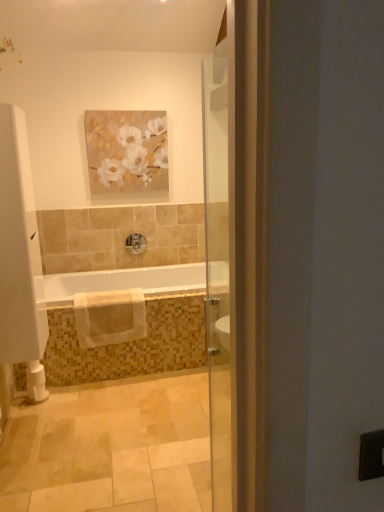
What is the approximate width of white towel at center?

white towel at center is 32.50 inches in width.

Describe the element at coordinates (136, 243) in the screenshot. I see `satin nickel faucet at center` at that location.

Identify the location of beige cotton towel at lower center. (109, 317).

What is the approximate height of white glossy bathtub at center?

white glossy bathtub at center is 0.75 inches in height.

This screenshot has width=384, height=512. What are the coordinates of `white towel at center` in the screenshot? It's located at (136, 340).

Does point (56, 288) come in front of point (105, 118)?

That is True.

Based on the photo, would you say matte floral painting at upper center is part of white glossy bathtub at center's contents?

No, white glossy bathtub at center does not contain matte floral painting at upper center.

Based on the photo, how much distance is there between white glossy bathtub at center and matte floral painting at upper center?

They are 3.37 feet apart.

Is white glossy bathtub at center facing away from matte floral painting at upper center?

No, white glossy bathtub at center is not facing away from matte floral painting at upper center.

Between point (165, 130) and point (64, 308), which one is positioned in front?

Point (64, 308)

Are matte floral painting at upper center and white towel at center making contact?

No, matte floral painting at upper center is not touching white towel at center.

From a real-world perspective, which is physically above, matte floral painting at upper center or white towel at center?

matte floral painting at upper center, from a real-world perspective.

In terms of height, does matte floral painting at upper center look taller or shorter compared to white towel at center?

matte floral painting at upper center is taller than white towel at center.

Measure the distance from beige cotton towel at lower center to satin nickel faucet at center.

beige cotton towel at lower center is 38.89 inches away from satin nickel faucet at center.

Which is more to the right, beige cotton towel at lower center or satin nickel faucet at center?

Positioned to the right is satin nickel faucet at center.

Is beige cotton towel at lower center positioned before satin nickel faucet at center?

Yes, beige cotton towel at lower center is closer to the viewer.

Consider the image. From the image's perspective, is beige cotton towel at lower center beneath satin nickel faucet at center?

Indeed, from the image's perspective, beige cotton towel at lower center is shown beneath satin nickel faucet at center.

Which of these two, white towel at center or white glossy bathtub at center, is smaller?

white glossy bathtub at center is smaller.

Based on the photo, how many degrees apart are the facing directions of white towel at center and white glossy bathtub at center?

white towel at center and white glossy bathtub at center are facing 0.168 degrees away from each other.

Is white towel at center not inside white glossy bathtub at center?

white towel at center is positioned outside white glossy bathtub at center.

From the image's perspective, is white towel at center above or below white glossy bathtub at center?

Based on their image positions, white towel at center is located beneath white glossy bathtub at center.

Considering the relative positions of white glossy bathtub at center and satin nickel faucet at center in the image provided, is white glossy bathtub at center to the left or to the right of satin nickel faucet at center?

white glossy bathtub at center is positioned on satin nickel faucet at center's right side.

Is white glossy bathtub at center next to satin nickel faucet at center?

No, white glossy bathtub at center is not with satin nickel faucet at center.

Is white glossy bathtub at center behind satin nickel faucet at center?

That is False.

Is beige cotton towel at lower center further to camera compared to matte floral painting at upper center?

No, it is not.

Is beige cotton towel at lower center directly adjacent to matte floral painting at upper center?

No, beige cotton towel at lower center is not making contact with matte floral painting at upper center.

Which of these two, white towel at center or matte floral painting at upper center, is wider?

With larger width is white towel at center.

Does point (91, 362) appear closer or farther from the camera than point (101, 162)?

Point (91, 362) is positioned closer to the camera compared to point (101, 162).

Is white towel at center not inside matte floral painting at upper center?

Yes, white towel at center is not within matte floral painting at upper center.

The width and height of the screenshot is (384, 512). What are the coordinates of `picture frame lying behind the white glossy bathtub at center` in the screenshot? It's located at (127, 151).

At what (x,y) coordinates should I click in order to perform the action: click on picture frame on the left of white towel at center. Please return your answer as a coordinate pair (x, y). This screenshot has height=512, width=384. Looking at the image, I should click on (127, 151).

Based on their spatial positions, is matte floral painting at upper center or satin nickel faucet at center further from beige cotton towel at lower center?

matte floral painting at upper center is positioned further to the anchor beige cotton towel at lower center.

From the image, which object appears to be nearer to satin nickel faucet at center, white towel at center or matte floral painting at upper center?

matte floral painting at upper center is closer to satin nickel faucet at center.

Estimate the real-world distances between objects in this image. Which object is closer to white glossy bathtub at center, white towel at center or matte floral painting at upper center?

Among the two, white towel at center is located nearer to white glossy bathtub at center.

Considering their positions, is white glossy bathtub at center positioned closer to matte floral painting at upper center than white towel at center?

white glossy bathtub at center is positioned closer to the anchor matte floral painting at upper center.

From the image, which object appears to be nearer to satin nickel faucet at center, matte floral painting at upper center or beige cotton towel at lower center?

matte floral painting at upper center is positioned closer to the anchor satin nickel faucet at center.

Estimate the real-world distances between objects in this image. Which object is further from white towel at center, beige cotton towel at lower center or white glossy bathtub at center?

Based on the image, white glossy bathtub at center appears to be further to white towel at center.

Looking at this image, from the image, which object appears to be farther from white glossy bathtub at center, beige cotton towel at lower center or white towel at center?

beige cotton towel at lower center is positioned further to the anchor white glossy bathtub at center.

Based on their spatial positions, is beige cotton towel at lower center or white glossy bathtub at center further from satin nickel faucet at center?

beige cotton towel at lower center is further to satin nickel faucet at center.

Find the location of a particular element. bath between matte floral painting at upper center and beige cotton towel at lower center in the up-down direction is located at coordinates (136, 340).

The height and width of the screenshot is (512, 384). What are the coordinates of `tap between matte floral painting at upper center and white glossy bathtub at center in the vertical direction` in the screenshot? It's located at (136, 243).

This screenshot has height=512, width=384. Find the location of `bathtub between matte floral painting at upper center and white towel at center vertically`. bathtub between matte floral painting at upper center and white towel at center vertically is located at coordinates (119, 282).

The height and width of the screenshot is (512, 384). I want to click on bath between white glossy bathtub at center and satin nickel faucet at center in the front-back direction, so click(136, 340).